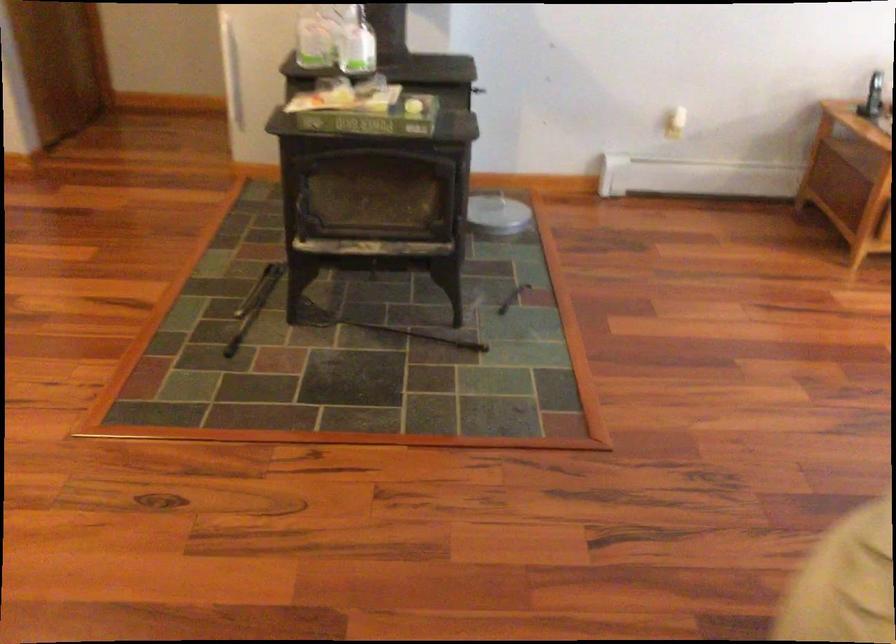
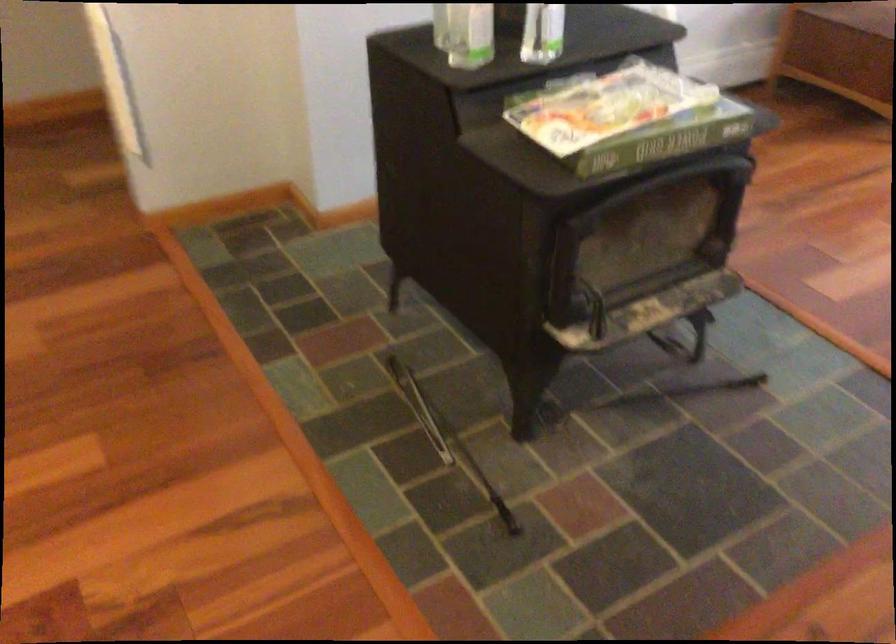
Locate, in the second image, the point that corresponds to point 453,199 in the first image.

(734, 211)